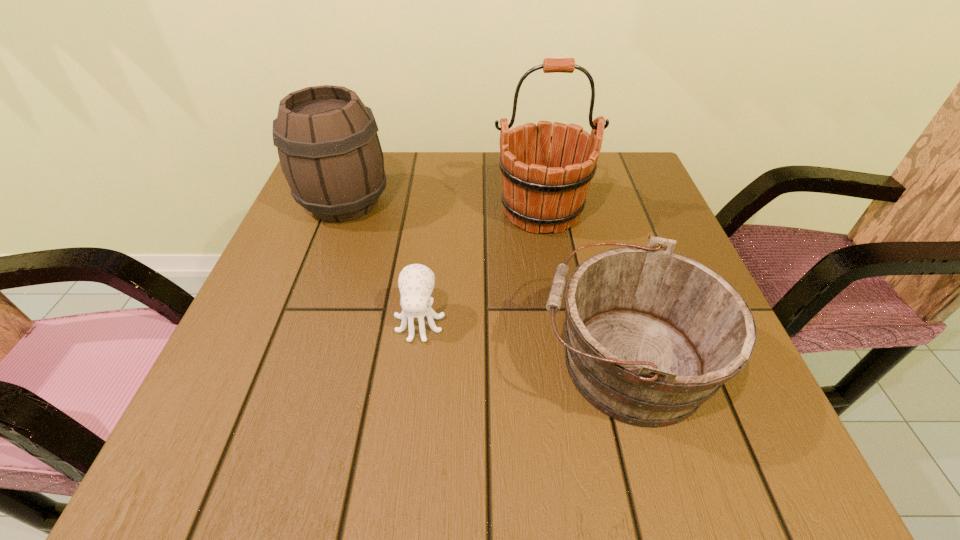
At what (x,y) coordinates should I click in order to perform the action: click on the tallest object. Please return your answer as a coordinate pair (x, y). The image size is (960, 540). Looking at the image, I should click on (536, 195).

Locate an element on the screen. This screenshot has width=960, height=540. the second tallest wine bucket is located at coordinates (330, 154).

In order to click on the leftmost wine bucket in this screenshot , I will do [330, 154].

Identify the location of the nearest wine bucket. (651, 335).

Where is `the shortest wine bucket`? Image resolution: width=960 pixels, height=540 pixels. the shortest wine bucket is located at coordinates (651, 335).

The image size is (960, 540). In order to click on the third object from right to left in this screenshot , I will do `click(416, 282)`.

Locate an element on the screen. This screenshot has height=540, width=960. octopus is located at coordinates (416, 282).

The image size is (960, 540). In order to click on vacant area situated 0.070m on the back of the tallest wine bucket in this screenshot , I will do `click(535, 171)`.

Image resolution: width=960 pixels, height=540 pixels. What are the coordinates of `vacant space located on the right of the leftmost object` in the screenshot? It's located at (501, 203).

Locate an element on the screen. Image resolution: width=960 pixels, height=540 pixels. vacant region located on the left of the shortest wine bucket is located at coordinates (422, 361).